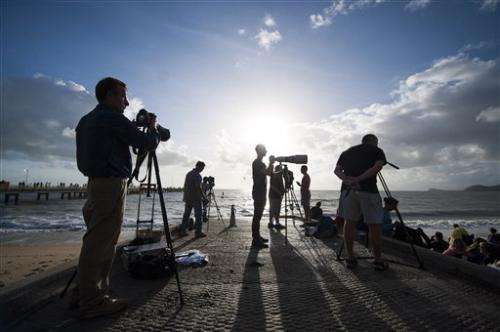
At what (x,y) coordinates should I click in order to perform the action: click on fabric or some type of plastic sheet. Please return your answer as a coordinate pair (x, y). This screenshot has height=332, width=500. Looking at the image, I should click on (194, 258).